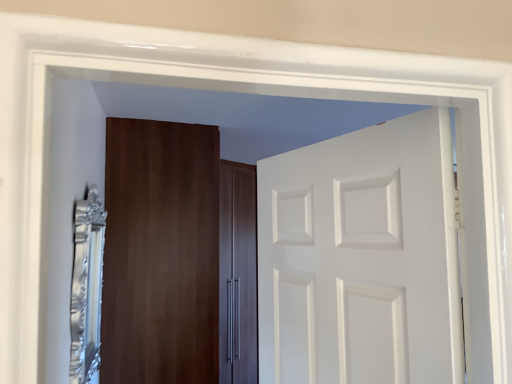
Question: Does silver metallic mirror at left appear on the left side of matte wood cabinet at center, arranged as the 2th door when viewed from the front?

Choices:
 (A) yes
 (B) no

Answer: (A)

Question: From the image's perspective, does silver metallic mirror at left appear lower than matte wood cabinet at center, which ranks as the 1th door in left-to-right order?

Choices:
 (A) yes
 (B) no

Answer: (B)

Question: Is matte wood cabinet at center, arranged as the 2th door when viewed from the front, surrounded by silver metallic mirror at left?

Choices:
 (A) no
 (B) yes

Answer: (A)

Question: Is silver metallic mirror at left at the right side of matte wood cabinet at center, which is the 2th door from right to left?

Choices:
 (A) no
 (B) yes

Answer: (A)

Question: Is silver metallic mirror at left wider than matte wood cabinet at center, arranged as the 2th door when viewed from the front?

Choices:
 (A) yes
 (B) no

Answer: (B)

Question: From their relative heights in the image, would you say white matte door at center, which ranks as the 2th door in left-to-right order, is taller or shorter than matte wood cabinet at center, which is the 2th door from right to left?

Choices:
 (A) tall
 (B) short

Answer: (B)

Question: From a real-world perspective, relative to matte wood cabinet at center, arranged as the 2th door when viewed from the front, is white matte door at center, which is the 1th door in front-to-back order, vertically above or below?

Choices:
 (A) above
 (B) below

Answer: (A)

Question: Looking at their shapes, would you say white matte door at center, which is the 1th door in front-to-back order, is wider or thinner than matte wood cabinet at center, arranged as the 2th door when viewed from the front?

Choices:
 (A) wide
 (B) thin

Answer: (B)

Question: Considering the positions of point (370, 241) and point (210, 316), is point (370, 241) closer or farther from the camera than point (210, 316)?

Choices:
 (A) farther
 (B) closer

Answer: (B)

Question: Considering the positions of white matte door at center, which appears as the first door when viewed from the right, and silver metallic mirror at left in the image, is white matte door at center, which appears as the first door when viewed from the right, wider or thinner than silver metallic mirror at left?

Choices:
 (A) thin
 (B) wide

Answer: (B)

Question: Based on their positions, is white matte door at center, which is the 1th door in front-to-back order, located to the left or right of silver metallic mirror at left?

Choices:
 (A) right
 (B) left

Answer: (A)

Question: Is white matte door at center, the second door viewed from the back, in front of or behind silver metallic mirror at left in the image?

Choices:
 (A) front
 (B) behind

Answer: (A)

Question: Is white matte door at center, which appears as the first door when viewed from the right, taller or shorter than silver metallic mirror at left?

Choices:
 (A) short
 (B) tall

Answer: (A)

Question: From a real-world perspective, is silver metallic mirror at left above or below white matte door at center, which appears as the first door when viewed from the right?

Choices:
 (A) below
 (B) above

Answer: (A)

Question: In terms of height, does silver metallic mirror at left look taller or shorter compared to white matte door at center, which appears as the first door when viewed from the right?

Choices:
 (A) short
 (B) tall

Answer: (B)